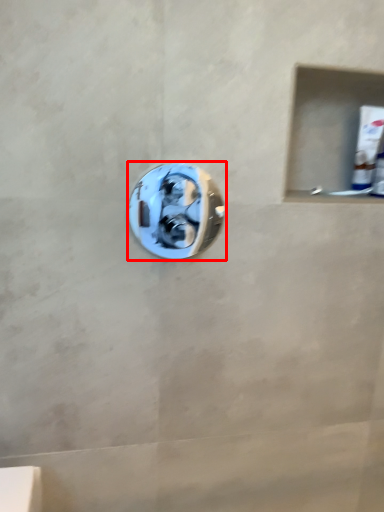
Question: In this image, where is door handle (annotated by the red box) located relative to toothpaste?

Choices:
 (A) left
 (B) right

Answer: (A)